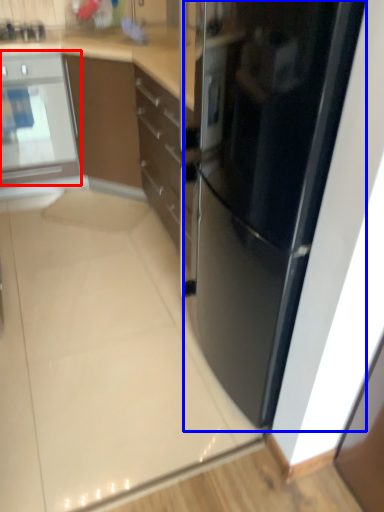
Question: Which of the following is the farthest to the observer, home appliance (highlighted by a red box) or refrigerator (highlighted by a blue box)?

Choices:
 (A) home appliance
 (B) refrigerator

Answer: (A)